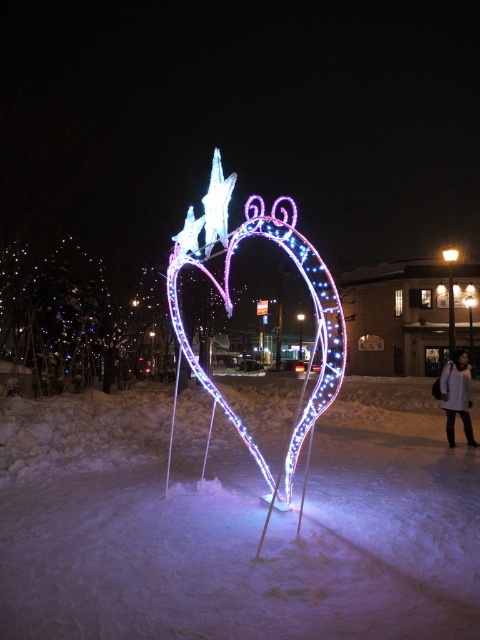
Can you confirm if icy white snow at center is positioned to the right of illuminated plastic heart at center?

Correct, you'll find icy white snow at center to the right of illuminated plastic heart at center.

Which of these two, icy white snow at center or illuminated plastic heart at center, stands shorter?

With less height is icy white snow at center.

Which is behind, point (316, 458) or point (336, 380)?

Point (316, 458)

At what (x,y) coordinates should I click in order to perform the action: click on icy white snow at center. Please return your answer as a coordinate pair (x, y). Looking at the image, I should click on (235, 524).

Who is higher up, illuminated plastic heart at center or white wool coat at lower right?

illuminated plastic heart at center is higher up.

Between point (276, 484) and point (442, 372), which one is positioned in front?

Point (276, 484) is in front.

Does point (320, 340) come in front of point (464, 390)?

Yes, point (320, 340) is in front of point (464, 390).

The width and height of the screenshot is (480, 640). Find the location of `illuminated plastic heart at center`. illuminated plastic heart at center is located at coordinates (231, 308).

How distant is icy white snow at center from white wool coat at lower right?

They are 3.86 meters apart.

Looking at this image, who is more forward, (x=252, y=403) or (x=468, y=384)?

Point (x=468, y=384)

What do you see at coordinates (235, 524) in the screenshot? The width and height of the screenshot is (480, 640). I see `icy white snow at center` at bounding box center [235, 524].

I want to click on icy white snow at center, so click(235, 524).